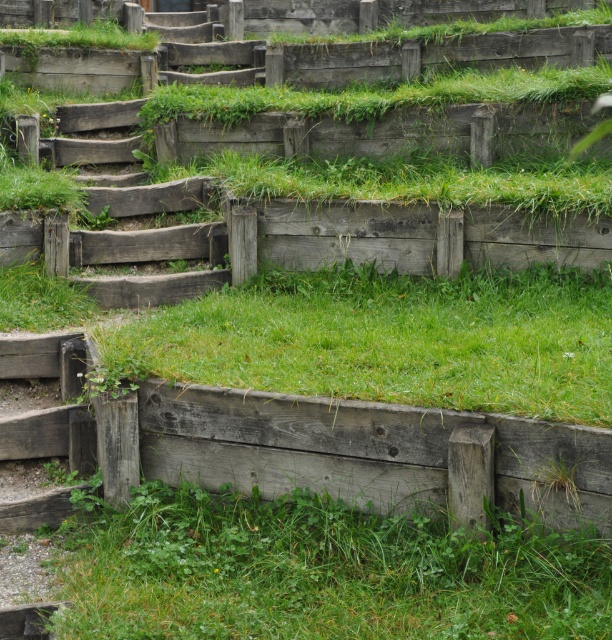
You are a gardener who wants to plant a new flower bed. You have two areas to choose from in the image. Which area would you choose between the green grassy at lower center and the weathered wood stairs at center, and why?

The green grassy at lower center is positioned under weathered wood stairs at center, so it is more accessible and suitable for planting a flower bed since it is already covered with grass and has space beneath the stairs.